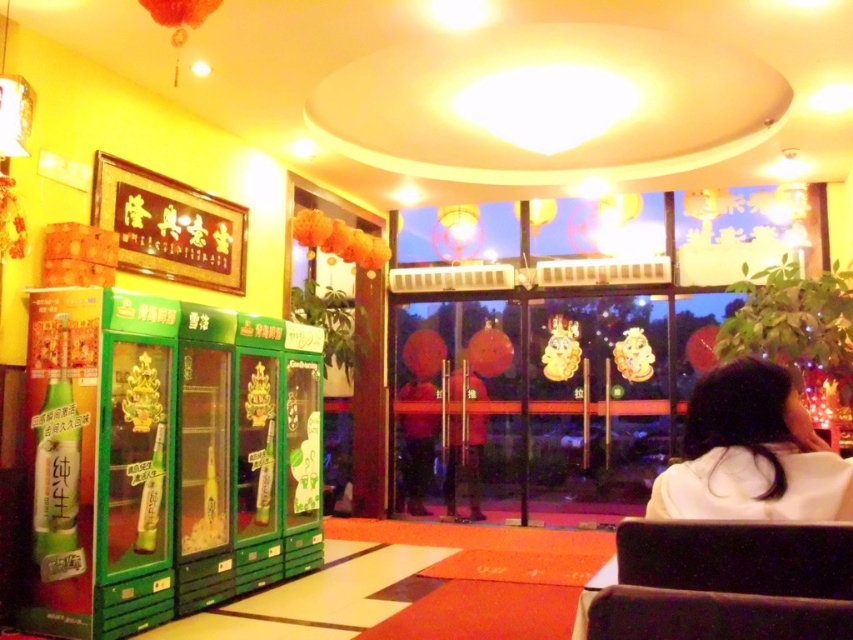
Is velvet brown chair at lower right below white matte hair at lower right?

Indeed, velvet brown chair at lower right is positioned under white matte hair at lower right.

Describe the element at coordinates (727, 582) in the screenshot. This screenshot has height=640, width=853. I see `velvet brown chair at lower right` at that location.

Does point (793, 568) lie behind point (714, 488)?

No, (793, 568) is in front of (714, 488).

What are the coordinates of `velvet brown chair at lower right` in the screenshot? It's located at (727, 582).